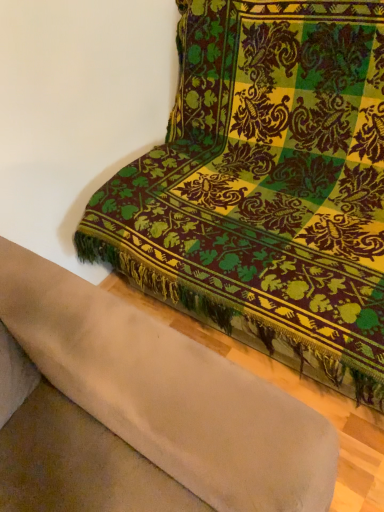
The width and height of the screenshot is (384, 512). What do you see at coordinates (266, 187) in the screenshot?
I see `velvet-like green and yellow cushion at upper right` at bounding box center [266, 187].

Identify the location of velvet-like green and yellow cushion at upper right. This screenshot has width=384, height=512. (266, 187).

Find the location of a particular element. velvet-like green and yellow cushion at upper right is located at coordinates (266, 187).